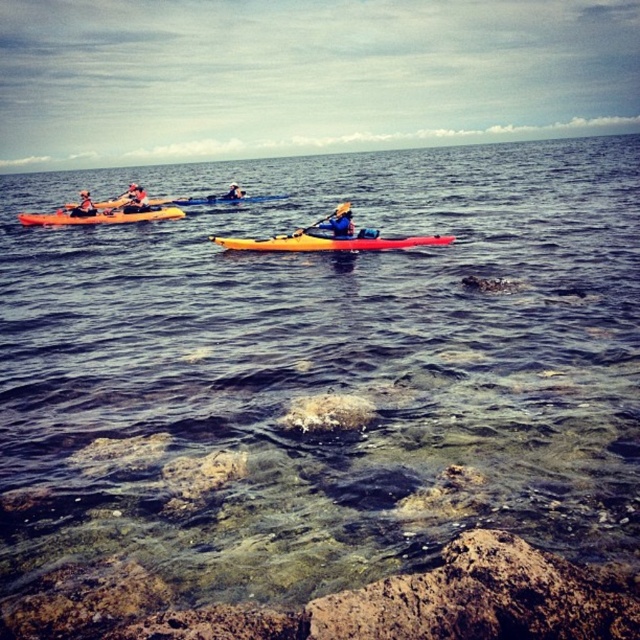
Question: Which point is closer to the camera?

Choices:
 (A) (349, 244)
 (B) (58, 220)
 (C) (90, 216)
 (D) (225, 196)

Answer: (A)

Question: Considering the relative positions of wooden paddle at center and yellow kayak at center in the image provided, where is wooden paddle at center located with respect to yellow kayak at center?

Choices:
 (A) below
 (B) above

Answer: (A)

Question: Can you confirm if clear water at center is wider than orange matte kayak at center?

Choices:
 (A) yes
 (B) no

Answer: (A)

Question: Can you confirm if clear water at center is wider than matte black kayak at upper left?

Choices:
 (A) yes
 (B) no

Answer: (A)

Question: Considering the real-world distances, which object is farthest from the matte yellow kayak at center?

Choices:
 (A) orange kayak at left
 (B) wooden paddle at center
 (C) yellow kayak at center
 (D) clear water at center

Answer: (D)

Question: Among these objects, which one is farthest from the camera?

Choices:
 (A) orange kayak at left
 (B) clear water at center
 (C) wooden paddle at center

Answer: (A)